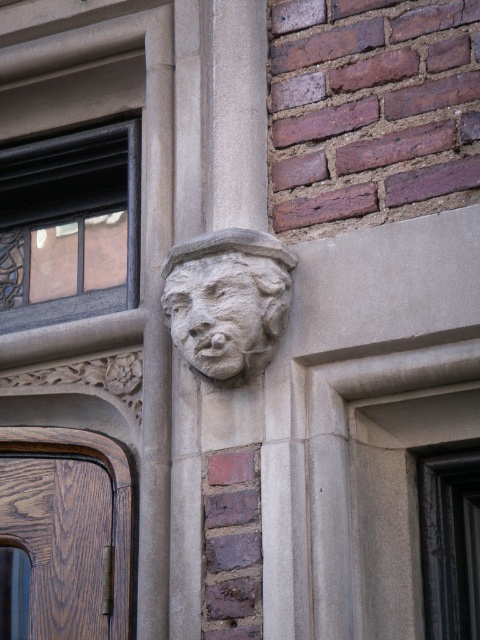
Is point (28, 442) positioned behind point (207, 362)?

Yes.

Which is in front, point (17, 429) or point (257, 300)?

Point (257, 300) is in front.

The height and width of the screenshot is (640, 480). Find the location of `brown wood door at lower left`. brown wood door at lower left is located at coordinates (69, 528).

Does gray stone face at center have a larger size compared to stone carved face at upper center?

Yes.

Does gray stone face at center have a lesser width compared to stone carved face at upper center?

No, gray stone face at center is not thinner than stone carved face at upper center.

Is point (269, 237) positioned in front of point (238, 349)?

No.

The width and height of the screenshot is (480, 640). I want to click on gray stone face at center, so click(x=228, y=301).

Describe the element at coordinates (69, 528) in the screenshot. I see `brown wood door at lower left` at that location.

Is point (48, 480) positioned after point (233, 356)?

Yes, it is.

Measure the distance between point (76,588) and camera.

8.23 meters

Identify the location of brown wood door at lower left. Image resolution: width=480 pixels, height=640 pixels. (69, 528).